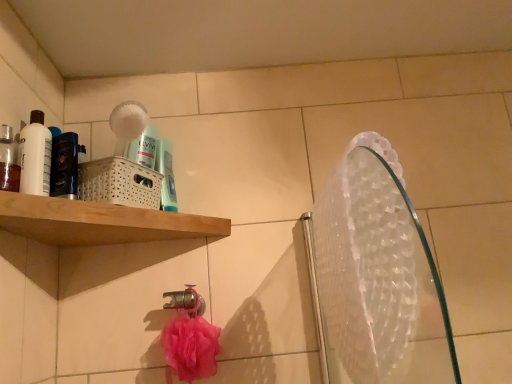
Question: Does point (403, 372) appear closer or farther from the camera than point (166, 147)?

Choices:
 (A) closer
 (B) farther

Answer: (A)

Question: Considering the positions of transparent plastic mirror at upper right and blue glossy mouthwash at upper center, the first mouthwash positioned from the right, in the image, is transparent plastic mirror at upper right taller or shorter than blue glossy mouthwash at upper center, the first mouthwash positioned from the right,?

Choices:
 (A) tall
 (B) short

Answer: (A)

Question: Considering the real-world distances, which object is closest to the metallic chrome tap at lower center?

Choices:
 (A) translucent plastic mouthwash at left, which appears as the first mouthwash when viewed from the left
 (B) white glossy bottle at left, the second mouthwash when ordered from front to back
 (C) transparent plastic mirror at upper right
 (D) blue glossy mouthwash at upper center, which is the first mouthwash in back-to-front order

Answer: (D)

Question: Which is nearer to the transparent plastic mirror at upper right?

Choices:
 (A) white glossy bottle at left, the second mouthwash from the right
 (B) blue glossy mouthwash at upper center, which is the first mouthwash in back-to-front order
 (C) translucent plastic mouthwash at left, the third mouthwash from the back
 (D) metallic chrome tap at lower center

Answer: (D)